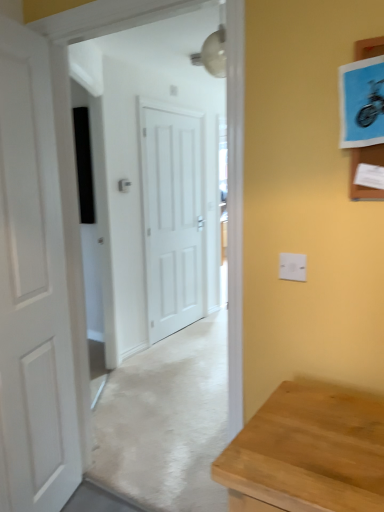
Question: Is white plastic electric outlet at upper right not near white matte door at center, which appears as the second door when viewed from the left?

Choices:
 (A) yes
 (B) no

Answer: (A)

Question: From the image's perspective, would you say white plastic electric outlet at upper right is shown under white matte door at center, which appears as the second door when viewed from the left?

Choices:
 (A) no
 (B) yes

Answer: (B)

Question: From a real-world perspective, is white plastic electric outlet at upper right below white matte door at center, which appears as the second door when viewed from the left?

Choices:
 (A) yes
 (B) no

Answer: (B)

Question: Can you confirm if white plastic electric outlet at upper right is shorter than white matte door at center, which is the second door in front-to-back order?

Choices:
 (A) yes
 (B) no

Answer: (A)

Question: Does white plastic electric outlet at upper right have a greater height compared to white matte door at center, which is the second door in front-to-back order?

Choices:
 (A) yes
 (B) no

Answer: (B)

Question: From the image's perspective, is white plastic electric outlet at upper right above white matte door at center, which appears as the second door when viewed from the left?

Choices:
 (A) yes
 (B) no

Answer: (B)

Question: From the image's perspective, would you say white matte door at left, acting as the second door starting from the right, is positioned over white matte door at center, which ranks as the first door in back-to-front order?

Choices:
 (A) yes
 (B) no

Answer: (B)

Question: Considering the relative sizes of white matte door at left, the first door positioned from the left, and white matte door at center, which ranks as the first door in back-to-front order, in the image provided, is white matte door at left, the first door positioned from the left, shorter than white matte door at center, which ranks as the first door in back-to-front order,?

Choices:
 (A) no
 (B) yes

Answer: (A)

Question: Is white matte door at left, the first door positioned from the left, taller than white matte door at center, which is the 1th door in right-to-left order?

Choices:
 (A) no
 (B) yes

Answer: (B)

Question: Is white matte door at left, the first door positioned from the left, at the left side of white matte door at center, which is the second door in front-to-back order?

Choices:
 (A) yes
 (B) no

Answer: (A)

Question: Are white matte door at left, the second door positioned from the back, and white matte door at center, which ranks as the first door in back-to-front order, beside each other?

Choices:
 (A) no
 (B) yes

Answer: (A)

Question: Is white matte door at left, the second door positioned from the back, looking in the opposite direction of white matte door at center, which is the 1th door in right-to-left order?

Choices:
 (A) no
 (B) yes

Answer: (A)

Question: From a real-world perspective, does white matte door at center, which is the 1th door in right-to-left order, sit lower than white plastic electric outlet at upper right?

Choices:
 (A) no
 (B) yes

Answer: (B)